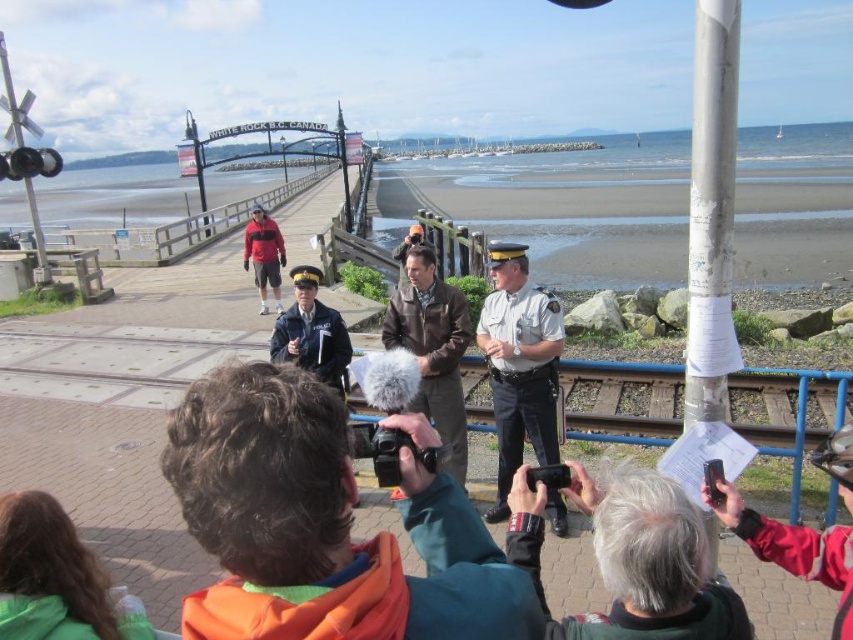
At what (x,y) coordinates should I click in order to perform the action: click on orange fleece jacket at center. Please return your answer as a coordinate pair (x, y). This screenshot has width=853, height=640. Looking at the image, I should click on (323, 525).

Can you confirm if orange fleece jacket at center is bigger than uniformed officer at center?

Yes.

Who is more distant from viewer, (222, 540) or (325, 360)?

Point (325, 360)

Locate an element on the screen. orange fleece jacket at center is located at coordinates (323, 525).

What do you see at coordinates (312, 332) in the screenshot? The image size is (853, 640). I see `uniformed officer at center` at bounding box center [312, 332].

In the scene shown: Who is shorter, uniformed officer at center or matte black jacket at center?

Standing shorter between the two is matte black jacket at center.

Locate an element on the screen. This screenshot has width=853, height=640. uniformed officer at center is located at coordinates (312, 332).

Identify the location of uniformed officer at center. Image resolution: width=853 pixels, height=640 pixels. (312, 332).

In order to click on brown leather jacket at center in this screenshot , I will do `click(433, 349)`.

Who is lower down, brown leather jacket at center or uniformed officer at center?

brown leather jacket at center is below.

Between point (426, 316) and point (317, 275), which one is positioned in front?

Point (426, 316) is in front.

Identify the location of brown leather jacket at center. This screenshot has width=853, height=640. (433, 349).